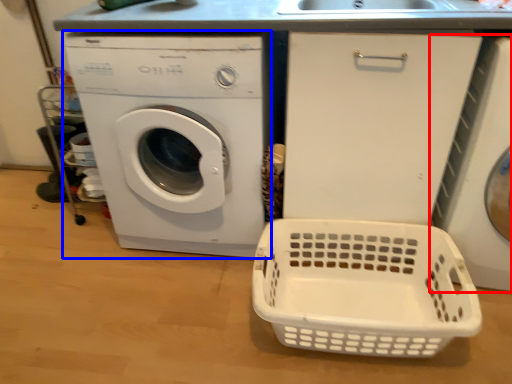
Question: Among these objects, which one is farthest to the camera, washing machine (highlighted by a red box) or washing machine (highlighted by a blue box)?

Choices:
 (A) washing machine
 (B) washing machine

Answer: (B)